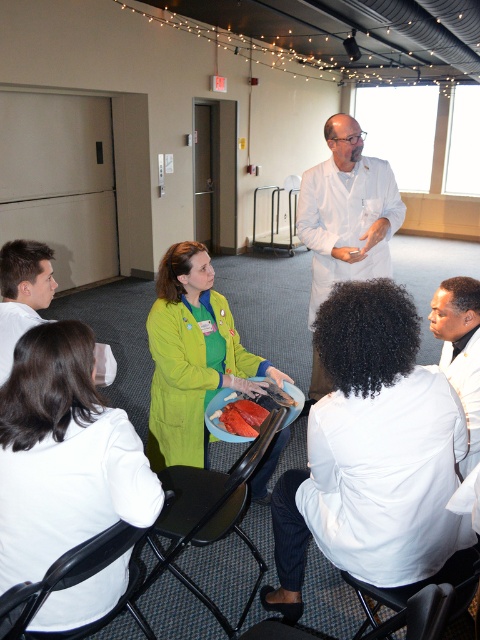
Is white lab coat at lower left below smooth orange plate at center?

Actually, white lab coat at lower left is above smooth orange plate at center.

Locate an element on the screen. This screenshot has width=480, height=640. white lab coat at lower left is located at coordinates (63, 454).

I want to click on white lab coat at lower left, so click(x=63, y=454).

Is green matte jacket at center to the right of white lab coat at center from the viewer's perspective?

No, green matte jacket at center is not to the right of white lab coat at center.

Can you confirm if green matte jacket at center is bigger than white lab coat at center?

Correct, green matte jacket at center is larger in size than white lab coat at center.

Locate an element on the screen. This screenshot has height=640, width=480. green matte jacket at center is located at coordinates (192, 356).

Where is `green matte jacket at center`? green matte jacket at center is located at coordinates (192, 356).

Is green fabric coat at center to the right of smooth white shirt at lower left from the viewer's perspective?

Correct, you'll find green fabric coat at center to the right of smooth white shirt at lower left.

What do you see at coordinates (372, 452) in the screenshot? The width and height of the screenshot is (480, 640). I see `green fabric coat at center` at bounding box center [372, 452].

Where is `green fabric coat at center`? The width and height of the screenshot is (480, 640). green fabric coat at center is located at coordinates (372, 452).